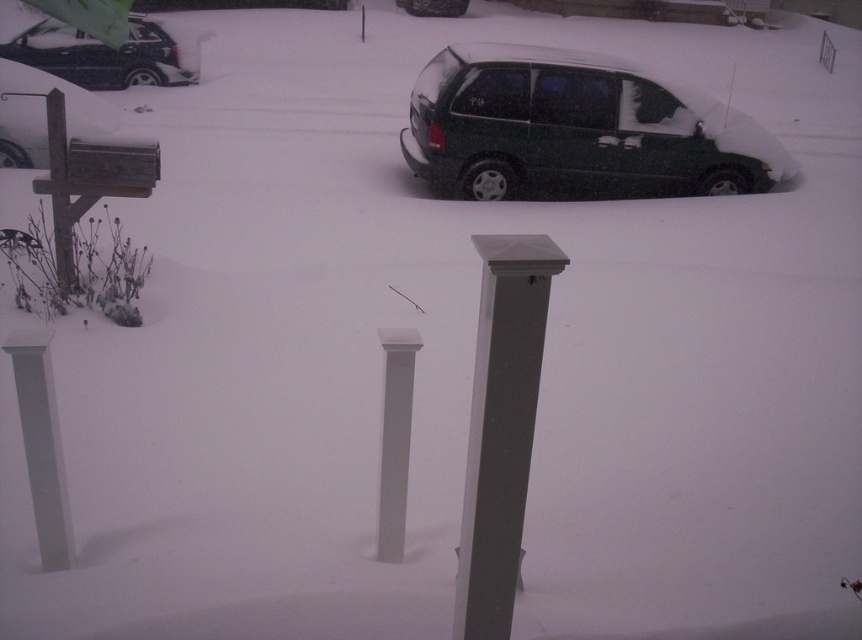
Based on the photo, you are a delivery person trying to navigate through the snowdrifts in this area. You need to deliver a package to the house behind the white glossy column at center. However, the green matte minivan at upper right is blocking your path. Can you go around the minivan to reach the column? Please explain your reasoning based on their positions.

The green matte minivan at upper right is located above the white glossy column at center. Since the minivan is positioned higher up, it might be blocking the direct path to the column. However, you could potentially go around it by moving to the left or right of the minivan to reach the column. The exact feasibility depends on the surrounding snowdrifts not mentioned in the scene description.

You are a drone operator trying to deliver a package to a location marked by two points in the snowy scene. The first point is at coordinates point (417, 84) and the second is at point (497, 589). Which point is closer to you, the drone operator, as you fly over the scene?

Point (417, 84) is closer to you than point (497, 589) because it is further to the viewer.